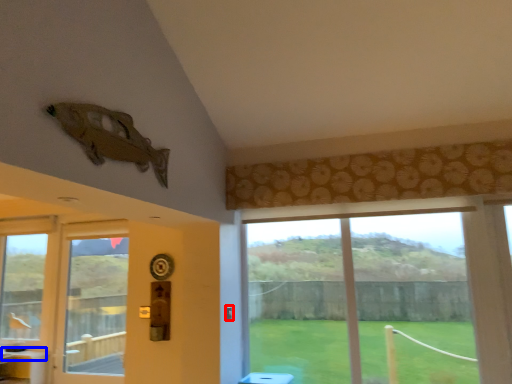
Question: Which of the following is the farthest to the observer, door handle (highlighted by a red box) or counter top (highlighted by a blue box)?

Choices:
 (A) door handle
 (B) counter top

Answer: (B)